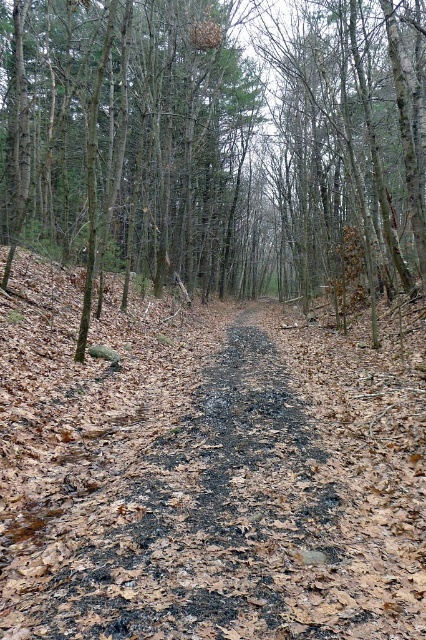
You are standing at the entrance of the forest path and want to reach a specific point marked as point [227,186]. The path is 2 meters wide. Can you walk straight to the point without stepping off the path?

The distance of point [227,186] from viewer is 24.27 meters. Since the path is 2 meters wide, you can walk straight to the point [227,186] without stepping off the path as long as you stay within the path width.

You are a hiker trying to follow the path through the forest. You notice the brown bark tree at center and the charcoal ash path at center. Which one is higher up in the scene?

The brown bark tree at center is above the charcoal ash path at center, so the tree is higher up in the scene.

You are a hiker trying to stay on the charcoal ash path at center while avoiding the brown bark tree at center. Is the path wide enough to walk around the tree without stepping off the path?

The brown bark tree at center might be wider than the charcoal ash path at center, so there is a possibility that the path is not wide enough to walk around the tree without stepping off the path.